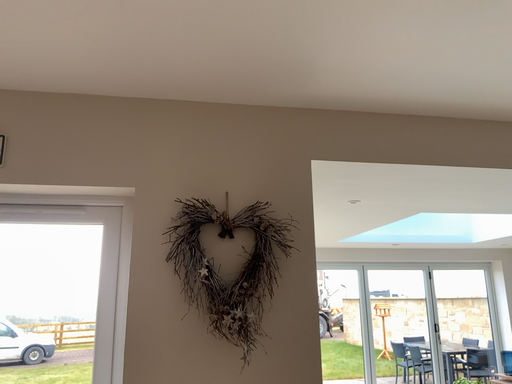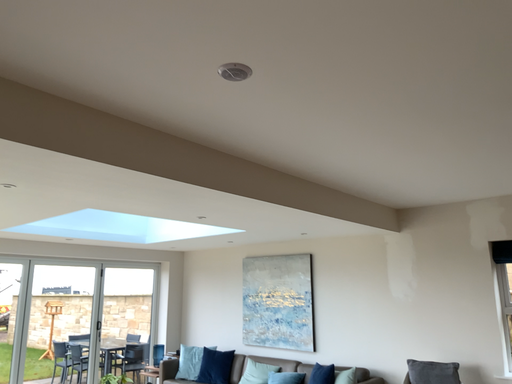
Question: How did the camera likely rotate when shooting the video?

Choices:
 (A) rotated right
 (B) rotated left

Answer: (A)